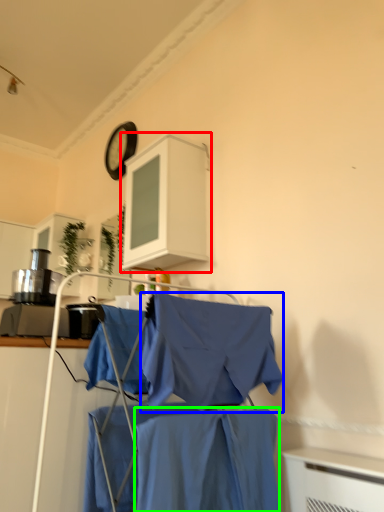
Question: Which object is positioned farthest from cabinetry (highlighted by a red box)? Select from cloak (highlighted by a blue box) and fabric (highlighted by a green box).

Choices:
 (A) cloak
 (B) fabric

Answer: (B)